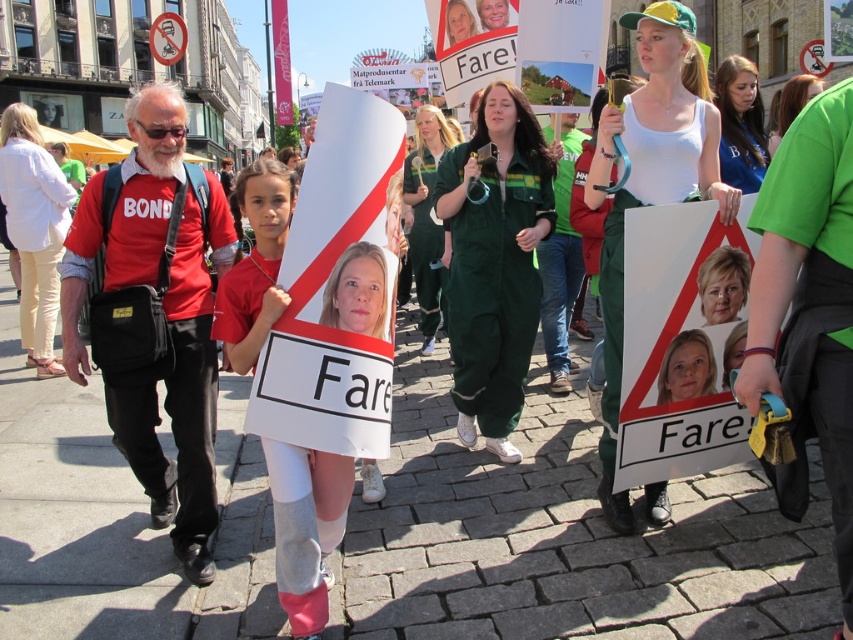
Question: Which of the following is the closest to the observer?

Choices:
 (A) (32, 243)
 (B) (689, 348)
 (C) (538, 204)
 (D) (808, 84)

Answer: (B)

Question: Which point is farther to the camera?

Choices:
 (A) (51, 369)
 (B) (618, 189)
 (C) (529, 298)
 (D) (758, 134)

Answer: (A)

Question: Can you confirm if white paper sign at center is bigger than matte blue shirt at center?

Choices:
 (A) yes
 (B) no

Answer: (B)

Question: Does green uniform at center appear over smooth white face at center?

Choices:
 (A) no
 (B) yes

Answer: (B)

Question: Is green uniform at center bigger than green fabric shirt at upper right?

Choices:
 (A) no
 (B) yes

Answer: (A)

Question: Which of the following is the closest to the observer?

Choices:
 (A) (683, 358)
 (B) (630, 100)

Answer: (A)